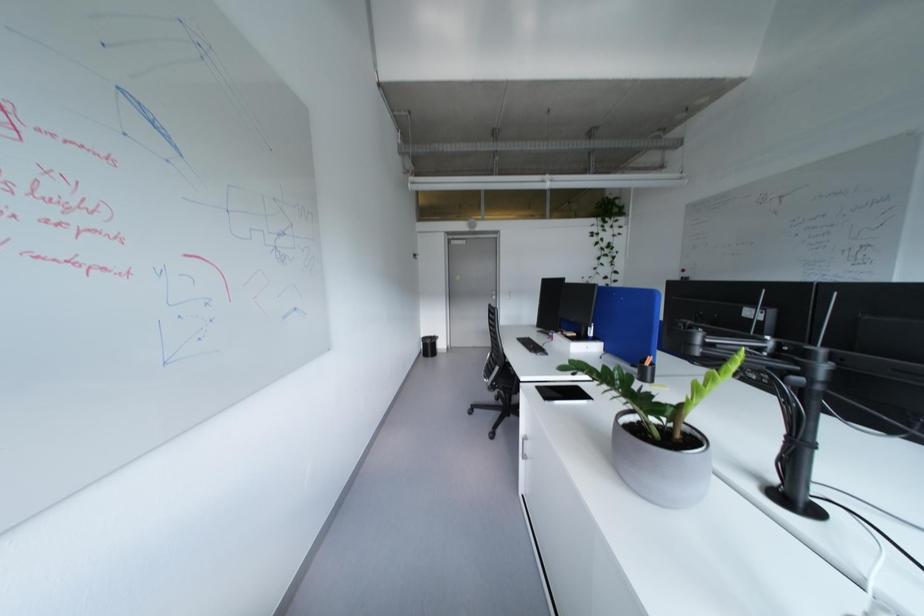
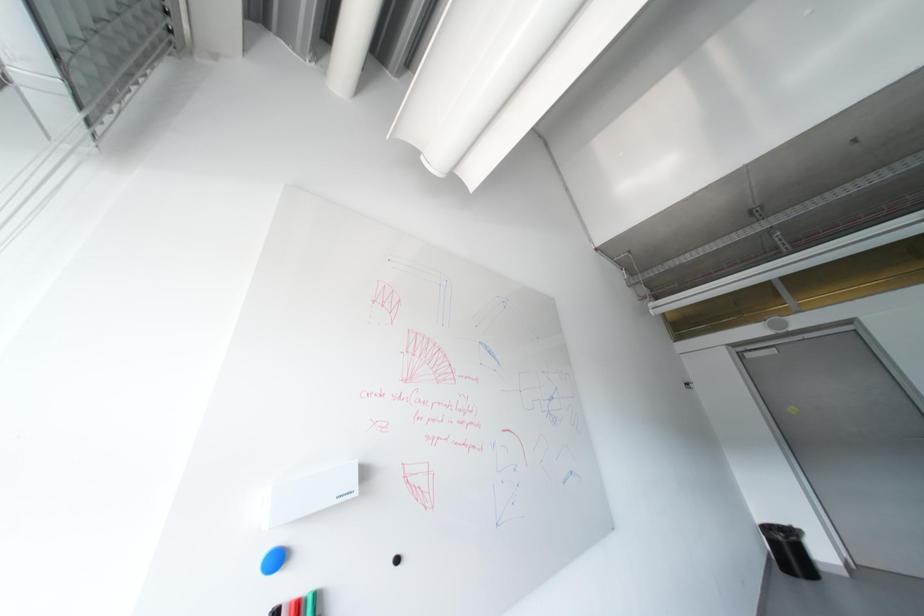
The first image is from the beginning of the video and the second image is from the end. How did the camera likely rotate when shooting the video?

The camera rotated toward left-up.